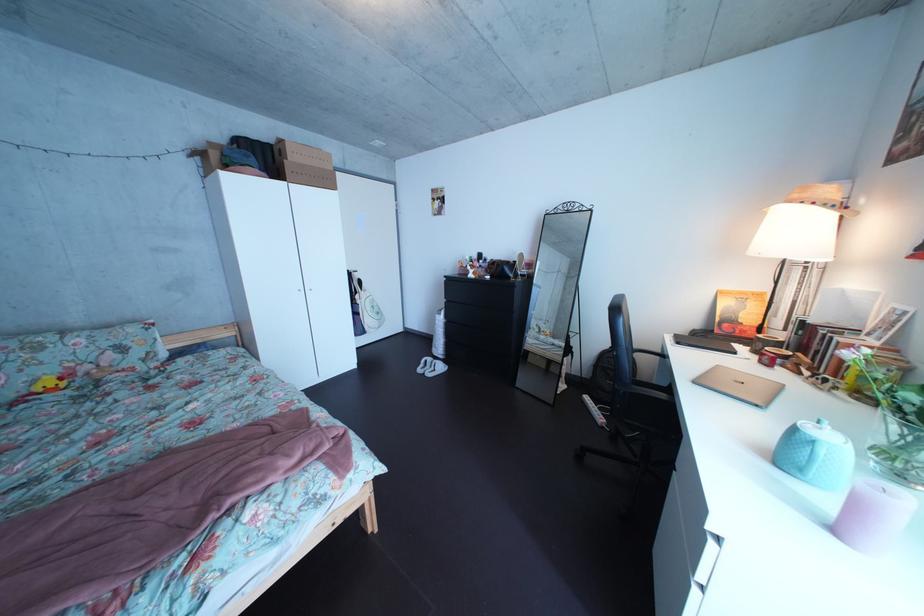
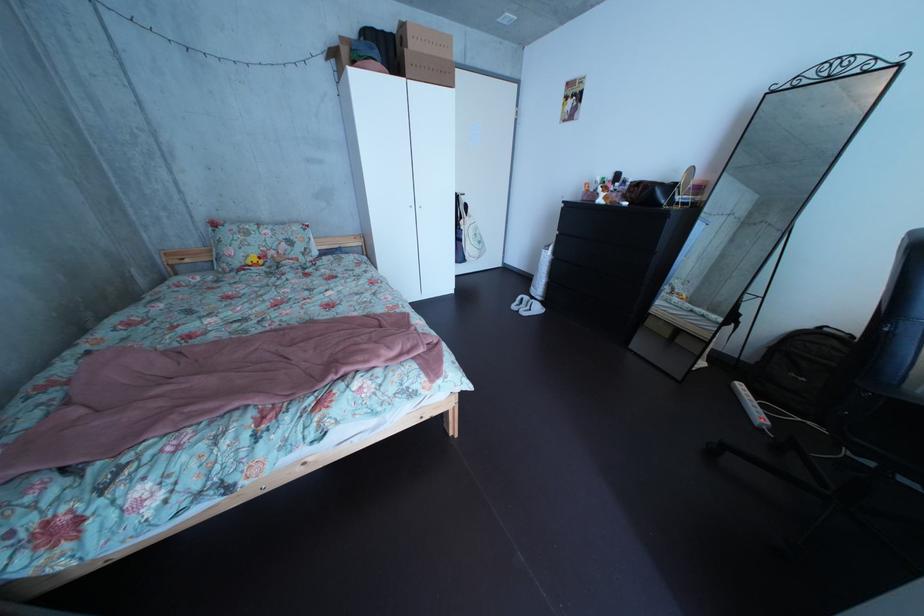
Locate, in the second image, the point that corresponds to [444,368] in the first image.

(541, 306)